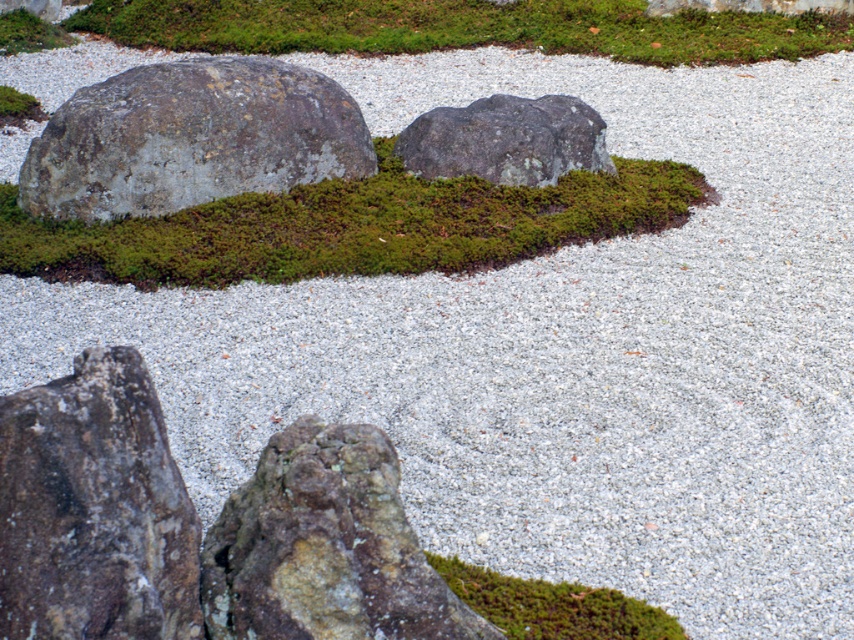
Question: Does green mossy patch at center have a lesser width compared to green mossy rock at lower left?

Choices:
 (A) yes
 (B) no

Answer: (B)

Question: Is gray rough boulder at left closer to the viewer compared to green moss at upper center?

Choices:
 (A) yes
 (B) no

Answer: (A)

Question: Which point is farther to the camera?

Choices:
 (A) (171, 132)
 (B) (278, 458)
 (C) (136, 412)
 (D) (726, 29)

Answer: (D)

Question: Which point appears farthest from the camera in this image?

Choices:
 (A) (414, 636)
 (B) (613, 627)

Answer: (B)

Question: Is green moss at upper center to the right of rough gray rock at center from the viewer's perspective?

Choices:
 (A) no
 (B) yes

Answer: (A)

Question: Which of the following is the closest to the observer?

Choices:
 (A) (506, 108)
 (B) (308, 3)

Answer: (A)